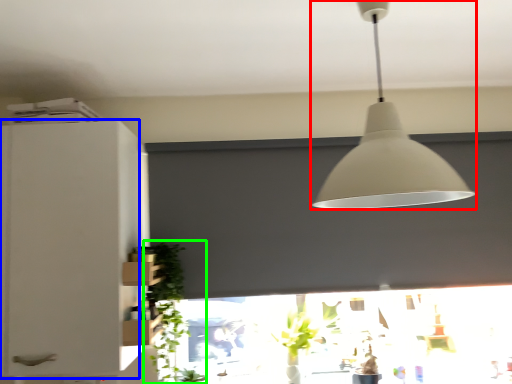
Question: Based on their relative distances, which object is nearer to lamp (highlighted by a red box)? Choose from cabinetry (highlighted by a blue box) and plant (highlighted by a green box).

Choices:
 (A) cabinetry
 (B) plant

Answer: (A)